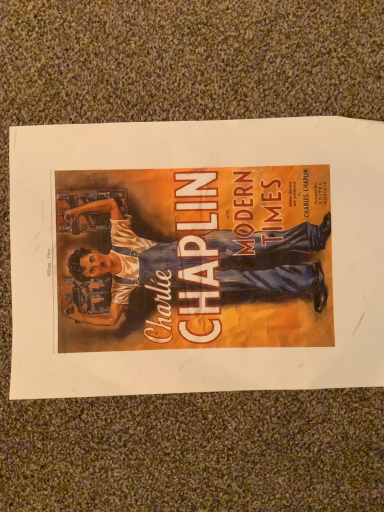
Image resolution: width=384 pixels, height=512 pixels. I want to click on vacant point above matte paper poster at center (from a real-world perspective), so click(x=199, y=260).